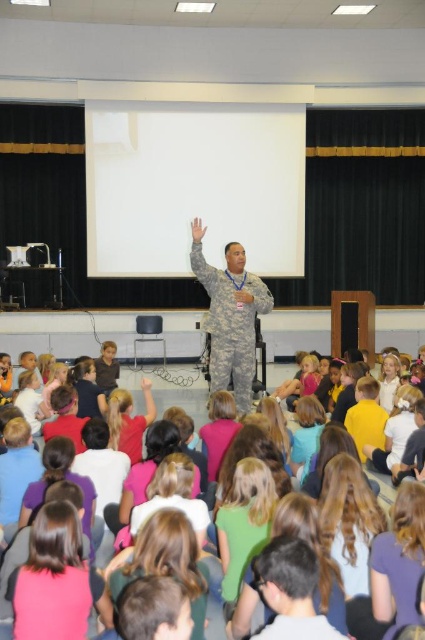
You are a photographer standing at the camera position. You want to take a closeup photo of the pink fabric hair at lower left. Can you reach it with your hand without moving from your current position?

The pink fabric hair at lower left is 2.17 meters away from camera, so you cannot reach it with your hand without moving from your current position.

You are a student in the classroom and want to see both the pink fabric hair at lower left and the camouflage uniform at center clearly. Which one is closer to your eye level?

The camouflage uniform at center is closer to your eye level since the pink fabric hair at lower left has a lesser height compared to it.